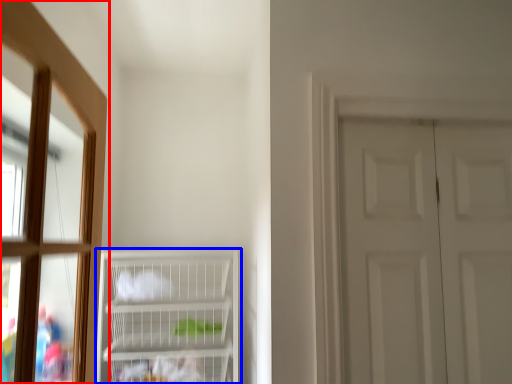
Question: Which object is further to the camera taking this photo, window (highlighted by a red box) or cupboard (highlighted by a blue box)?

Choices:
 (A) window
 (B) cupboard

Answer: (B)